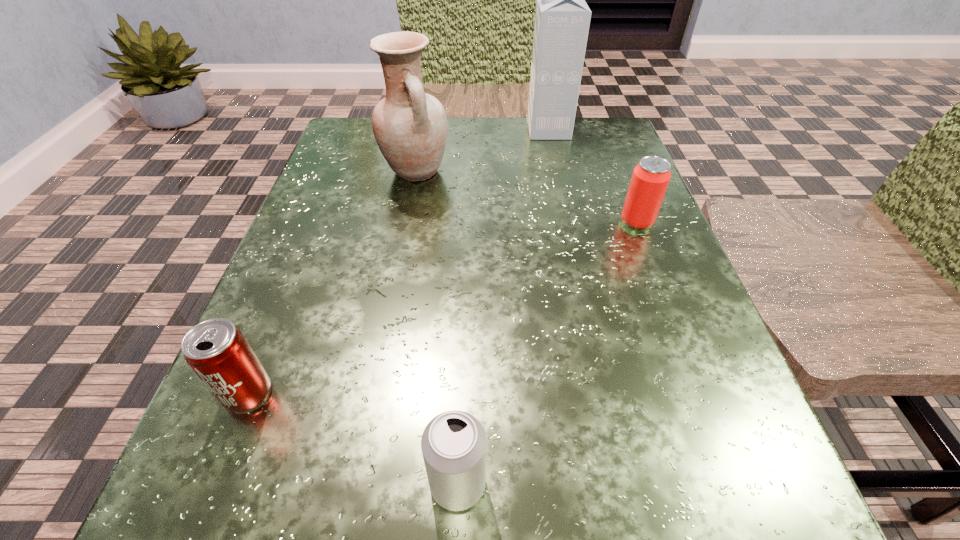
Identify the location of vacant space that satisfies the following two spatial constraints: 1. on the front side of the rightmost beer can; 2. on the left side of the second farthest object. The height and width of the screenshot is (540, 960). (407, 222).

Where is `free location that satisfies the following two spatial constraints: 1. on the front side of the fourth nearest object; 2. on the left side of the rightmost beer can`? free location that satisfies the following two spatial constraints: 1. on the front side of the fourth nearest object; 2. on the left side of the rightmost beer can is located at coordinates (407, 222).